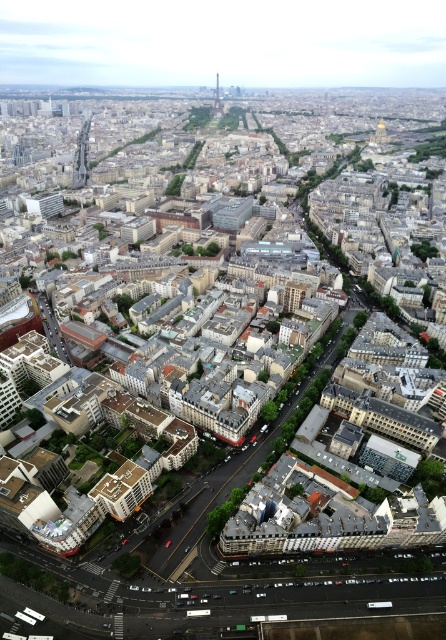
Between point (74, 182) and point (215, 100), which one is positioned in front?

Positioned in front is point (74, 182).

Is smooth glass skyscraper at upper left smaller than shiny metallic tower at center?

Incorrect, smooth glass skyscraper at upper left is not smaller in size than shiny metallic tower at center.

At what (x,y) coordinates should I click in order to perform the action: click on smooth glass skyscraper at upper left. Please return your answer as a coordinate pair (x, y). Looking at the image, I should click on (82, 156).

Find the location of a particular element. The height and width of the screenshot is (640, 446). smooth glass skyscraper at upper left is located at coordinates (82, 156).